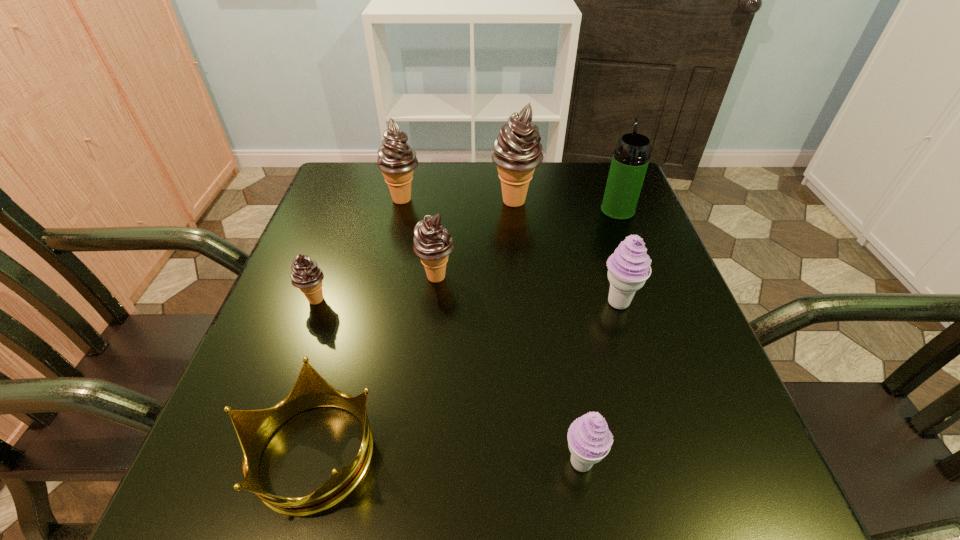
Find the location of a particular element. The height and width of the screenshot is (540, 960). free space between the tallest icecream and the smaller purple icecream is located at coordinates (548, 332).

This screenshot has height=540, width=960. I want to click on unoccupied position between the smallest chocolate icecream and the second tallest icecream, so click(359, 249).

Identify the location of free space that is in between the second biggest chocolate icecream and the nearest icecream. (492, 330).

You are a GUI agent. You are given a task and a screenshot of the screen. Output one action in this format:
    pyautogui.click(x=<x>, y=<y>)
    Task: Click on the empty space that is in between the crown and the thermos bottle
    The height and width of the screenshot is (540, 960).
    Given the screenshot: What is the action you would take?
    pyautogui.click(x=466, y=331)

I want to click on vacant region between the tallest icecream and the nearer purple icecream, so click(548, 332).

You are a GUI agent. You are given a task and a screenshot of the screen. Output one action in this format:
    pyautogui.click(x=<x>, y=<y>)
    Task: Click on the free point between the thermos bottle and the biggest chocolate icecream
    This screenshot has width=960, height=540.
    Given the screenshot: What is the action you would take?
    pyautogui.click(x=566, y=206)

Where is `vacant area between the tallest icecream and the nearer purple icecream`? vacant area between the tallest icecream and the nearer purple icecream is located at coordinates (548, 332).

What are the coordinates of `empty location between the second smallest chocolate icecream and the smaller purple icecream` in the screenshot? It's located at coord(509,369).

Where is `unoccupied position between the nearest icecream and the fifth icecream from right to left`? Image resolution: width=960 pixels, height=540 pixels. unoccupied position between the nearest icecream and the fifth icecream from right to left is located at coordinates (492, 330).

Locate an element on the screen. object that stands as the seventh closest to the tallest icecream is located at coordinates (589, 439).